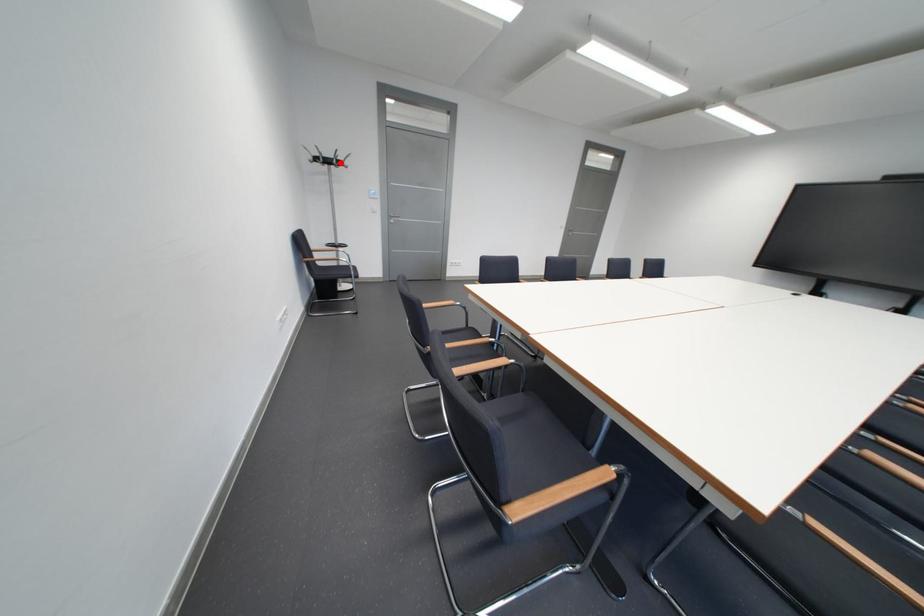
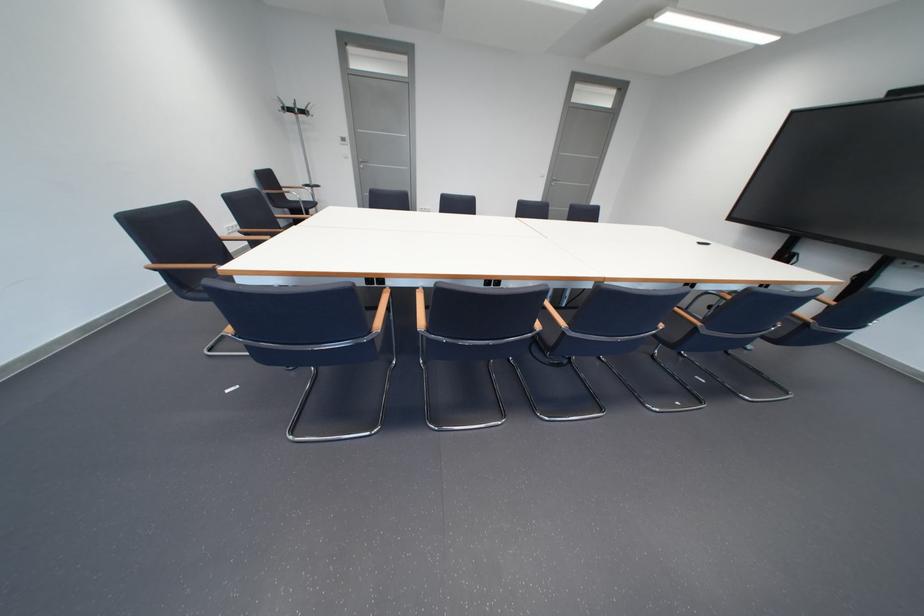
Locate, in the second image, the point that corresponds to the highlighted location in the first image.

(304, 111)